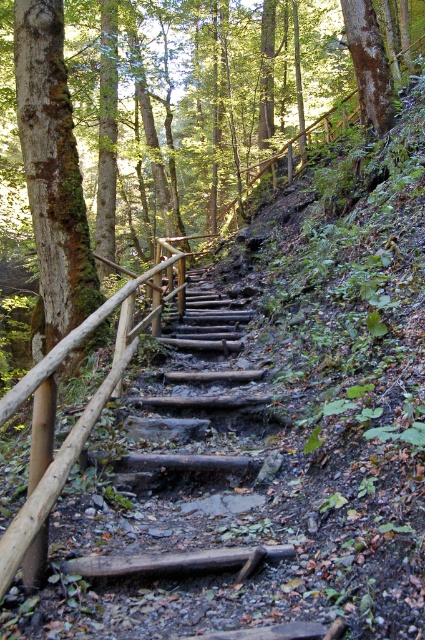
You are standing at the bottom of the rustic wooden stairs at center. Looking up, you notice a point marked at coordinates [206,339]. What does this point most likely represent in the scene?

The point at coordinates [206,339] corresponds to the rustic wooden stairs at center, indicating their central position within the scene.

You are standing at the base of the rustic wooden stairs at center in a forest. You want to walk up the stairs to reach a viewpoint located 15 feet away from the stairs. Considering the stairs are 13.60 feet long, will you be able to reach the viewpoint by climbing the stairs?

The rustic wooden stairs at center are 13.60 feet long. Since the viewpoint is 15 feet away from the stairs, climbing the stairs will get you close but not exactly to the viewpoint. However, you might need to walk an additional 1.4 feet beyond the stairs to reach it.